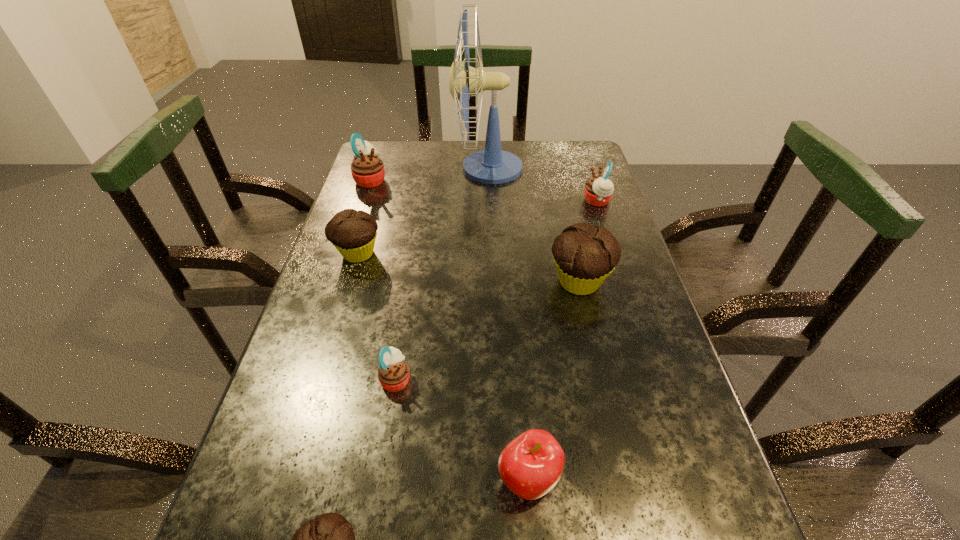
This screenshot has height=540, width=960. I want to click on vacant space situated on the back of the second biggest chocolate muffin, so click(x=366, y=227).

The width and height of the screenshot is (960, 540). In order to click on vacant region located on the back of the red apple in this screenshot , I will do `click(520, 374)`.

Locate an element on the screen. vacant position located 0.240m on the front-facing side of the third nearest object is located at coordinates (539, 379).

This screenshot has height=540, width=960. What are the coordinates of `fan situated at the far edge` in the screenshot? It's located at (492, 165).

You are a GUI agent. You are given a task and a screenshot of the screen. Output one action in this format:
    pyautogui.click(x=<x>, y=<y>)
    Task: Click on the muffin positioned at the far edge
    
    Given the screenshot: What is the action you would take?
    pyautogui.click(x=367, y=169)

Locate an element on the screen. The image size is (960, 540). object at the far left corner is located at coordinates pyautogui.click(x=367, y=169).

Find the location of a particular element. The height and width of the screenshot is (540, 960). free space at the far edge of the desktop is located at coordinates (440, 153).

This screenshot has width=960, height=540. What are the coordinates of `vacant region at the left edge of the desktop` in the screenshot? It's located at (262, 470).

Where is `free spot at the right edge of the desktop`? This screenshot has width=960, height=540. free spot at the right edge of the desktop is located at coordinates (684, 401).

The height and width of the screenshot is (540, 960). I want to click on vacant area at the far right corner of the desktop, so click(x=561, y=150).